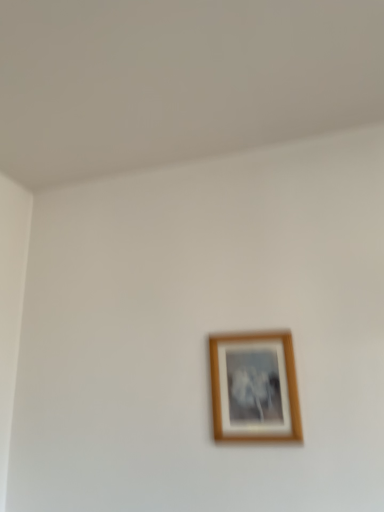
Image resolution: width=384 pixels, height=512 pixels. In order to click on wooden picture frame at center in this screenshot , I will do `click(255, 388)`.

Describe the element at coordinates (255, 388) in the screenshot. The width and height of the screenshot is (384, 512). I see `wooden picture frame at center` at that location.

The height and width of the screenshot is (512, 384). Identify the location of wooden picture frame at center. (255, 388).